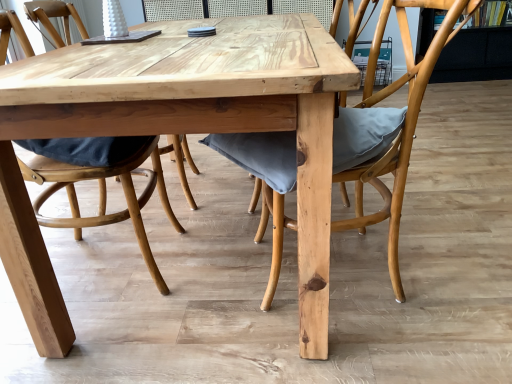
Find the location of a particular element. vacant area that is situated to the right of natural wood table at center is located at coordinates click(x=457, y=188).